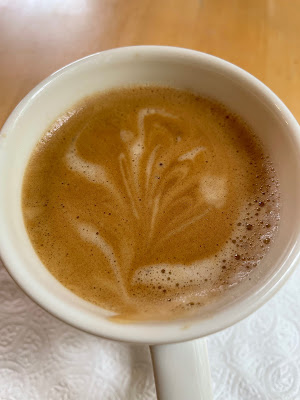
Where is `creases between the napkins`? Image resolution: width=300 pixels, height=400 pixels. creases between the napkins is located at coordinates (151, 352), (151, 367), (156, 383).